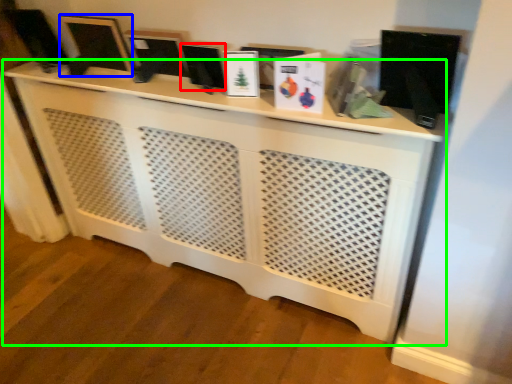
Question: Considering the real-world distances, which object is closest to computer monitor (highlighted by a red box)? computer monitor (highlighted by a blue box) or furniture (highlighted by a green box).

Choices:
 (A) computer monitor
 (B) furniture

Answer: (A)